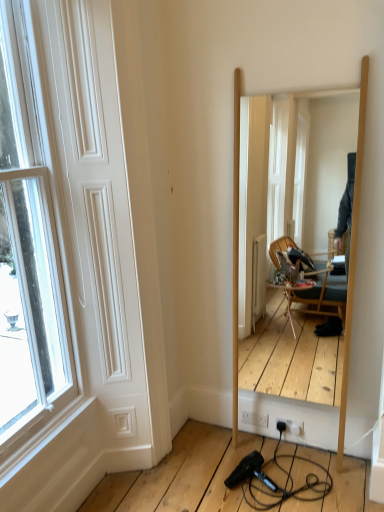
Question: In the image, is wooden mirror at center positioned in front of or behind white matte door at left?

Choices:
 (A) front
 (B) behind

Answer: (B)

Question: Considering the positions of wooden mirror at center and white matte door at left in the image, is wooden mirror at center bigger or smaller than white matte door at left?

Choices:
 (A) small
 (B) big

Answer: (B)

Question: Which of these objects is positioned farthest from the wooden mirror at center?

Choices:
 (A) black plastic hair dryer at lower center
 (B) white matte door at left

Answer: (A)

Question: Based on their relative distances, which object is nearer to the white matte door at left?

Choices:
 (A) black plastic hair dryer at lower center
 (B) wooden mirror at center

Answer: (A)